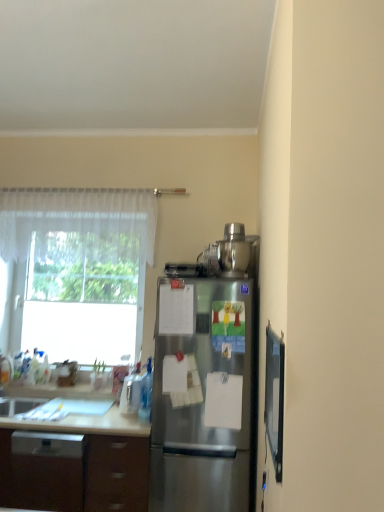
Question: From the image's perspective, is brown wood cabinet at lower left beneath sheer white curtain at upper left?

Choices:
 (A) yes
 (B) no

Answer: (A)

Question: Considering the relative sizes of brown wood cabinet at lower left and sheer white curtain at upper left in the image provided, is brown wood cabinet at lower left wider than sheer white curtain at upper left?

Choices:
 (A) no
 (B) yes

Answer: (B)

Question: Considering the relative sizes of brown wood cabinet at lower left and sheer white curtain at upper left in the image provided, is brown wood cabinet at lower left thinner than sheer white curtain at upper left?

Choices:
 (A) no
 (B) yes

Answer: (A)

Question: Considering the relative positions of brown wood cabinet at lower left and sheer white curtain at upper left in the image provided, is brown wood cabinet at lower left in front of sheer white curtain at upper left?

Choices:
 (A) yes
 (B) no

Answer: (A)

Question: Are brown wood cabinet at lower left and sheer white curtain at upper left making contact?

Choices:
 (A) yes
 (B) no

Answer: (B)

Question: Based on their positions, is clear plastic container at lower left, which is the first appliance from bottom to top, located to the left or right of stainless steel blender at upper right, which appears as the second appliance when ordered from the bottom?

Choices:
 (A) left
 (B) right

Answer: (A)

Question: Is clear plastic container at lower left, which is the first appliance from bottom to top, spatially inside stainless steel blender at upper right, marked as the 1th appliance in a top-to-bottom arrangement, or outside of it?

Choices:
 (A) outside
 (B) inside

Answer: (A)

Question: In terms of height, does clear plastic container at lower left, which is the first appliance from bottom to top, look taller or shorter compared to stainless steel blender at upper right, positioned as the 1th appliance in right-to-left order?

Choices:
 (A) short
 (B) tall

Answer: (A)

Question: From a real-world perspective, is clear plastic container at lower left, which is the 2th appliance from right to left, physically located above or below stainless steel blender at upper right, which appears as the second appliance when ordered from the bottom?

Choices:
 (A) above
 (B) below

Answer: (B)

Question: Relative to brown wood cabinet at lower left, is transparent glass window at left in front or behind?

Choices:
 (A) front
 (B) behind

Answer: (B)

Question: Which is correct: transparent glass window at left is inside brown wood cabinet at lower left, or outside of it?

Choices:
 (A) outside
 (B) inside

Answer: (A)

Question: In the image, is transparent glass window at left on the left side or the right side of brown wood cabinet at lower left?

Choices:
 (A) left
 (B) right

Answer: (A)

Question: Does point (59, 219) appear closer or farther from the camera than point (9, 489)?

Choices:
 (A) farther
 (B) closer

Answer: (A)

Question: From a real-world perspective, is transparent glass window at left physically located above or below matte black screen door at right?

Choices:
 (A) below
 (B) above

Answer: (B)

Question: Looking at their shapes, would you say transparent glass window at left is wider or thinner than matte black screen door at right?

Choices:
 (A) thin
 (B) wide

Answer: (B)